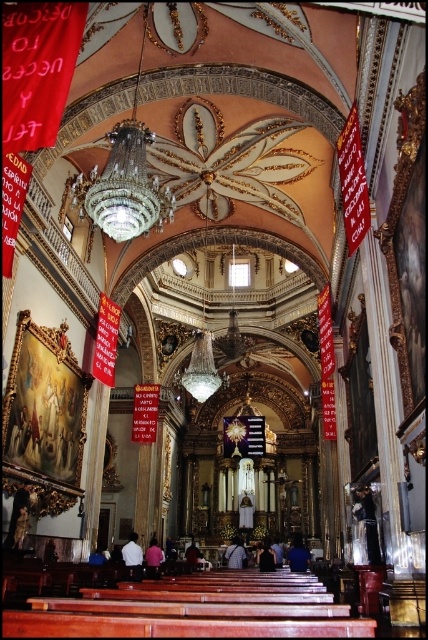
Can you confirm if white fabric shirt at center is shorter than dark blue fabric at center?

Yes, white fabric shirt at center is shorter than dark blue fabric at center.

Does white fabric shirt at center appear on the right side of dark blue fabric at center?

In fact, white fabric shirt at center is to the left of dark blue fabric at center.

You are a GUI agent. You are given a task and a screenshot of the screen. Output one action in this format:
    pyautogui.click(x=<x>, y=<y>)
    Task: Click on the white fabric shirt at center
    
    Given the screenshot: What is the action you would take?
    pyautogui.click(x=152, y=557)

This screenshot has width=428, height=640. In order to click on white fabric shirt at center in this screenshot , I will do `click(152, 557)`.

Is point (136, 573) in front of point (225, 550)?

That is True.

Measure the distance between point [139,576] and camera.

The distance of point [139,576] from camera is 73.12 meters.

This screenshot has width=428, height=640. I want to click on white cotton shirt at center, so [133, 556].

Is white cotton shirt at center further to the viewer compared to dark blue fabric at center?

No, white cotton shirt at center is closer to the viewer.

Identify the location of white cotton shirt at center. The image size is (428, 640). click(133, 556).